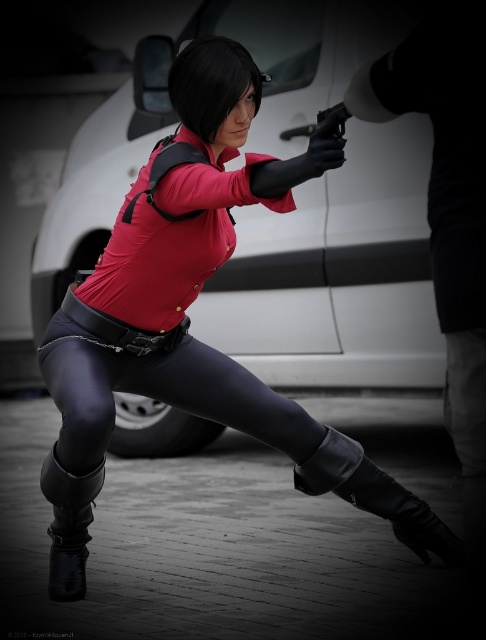
Does point (71, 348) lie behind point (339, 120)?

Yes, it is.

Measure the distance between black leather leggings at center and camera.

They are 3.72 meters apart.

Where is `black leather leggings at center`? The width and height of the screenshot is (486, 640). black leather leggings at center is located at coordinates (159, 392).

Who is positioned more to the left, black leather leggings at center or black leather boot at lower center?

black leather leggings at center is more to the left.

Identify the location of black leather leggings at center. (159, 392).

Describe the element at coordinates (159, 392) in the screenshot. This screenshot has width=486, height=640. I see `black leather leggings at center` at that location.

Image resolution: width=486 pixels, height=640 pixels. Find the location of `black leather leggings at center`. black leather leggings at center is located at coordinates (159, 392).

Does black leather boot at lower center lie behind black rubber gun at center?

Yes.

How far apart are black leather boot at lower center and black rubber gun at center?

9.52 feet

Is point (335, 476) positioned after point (301, 129)?

No, (335, 476) is in front of (301, 129).

Identify the location of black leather boot at lower center. This screenshot has height=640, width=486. (377, 497).